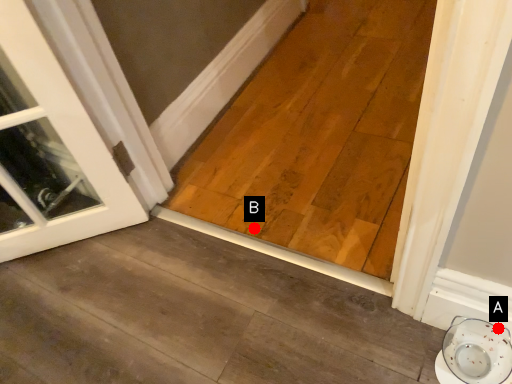
Question: Two points are circled on the image, labeled by A and B beside each circle. Which point is farther from the camera taking this photo?

Choices:
 (A) A is further
 (B) B is further

Answer: (B)